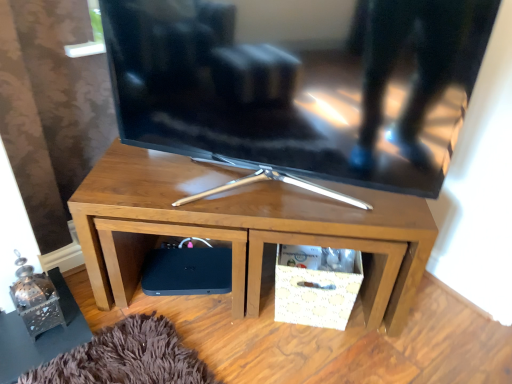
Question: Is matte black tv at center surrounded by black matte speaker at lower left?

Choices:
 (A) no
 (B) yes

Answer: (A)

Question: Could you tell me if black matte speaker at lower left is facing matte black tv at center?

Choices:
 (A) yes
 (B) no

Answer: (B)

Question: Does black matte speaker at lower left appear on the right side of matte black tv at center?

Choices:
 (A) no
 (B) yes

Answer: (A)

Question: Is black matte speaker at lower left wider than matte black tv at center?

Choices:
 (A) no
 (B) yes

Answer: (B)

Question: Is black matte speaker at lower left turned away from matte black tv at center?

Choices:
 (A) yes
 (B) no

Answer: (B)

Question: From the image's perspective, is matte black tv at center above or below wooden tv stand at center?

Choices:
 (A) above
 (B) below

Answer: (A)

Question: From a real-world perspective, is matte black tv at center physically located above or below wooden tv stand at center?

Choices:
 (A) above
 (B) below

Answer: (A)

Question: Is point (323, 56) closer or farther from the camera than point (180, 213)?

Choices:
 (A) closer
 (B) farther

Answer: (A)

Question: Is matte black tv at center in front of or behind wooden tv stand at center in the image?

Choices:
 (A) behind
 (B) front

Answer: (B)

Question: Choose the correct answer: Is wooden tv stand at center inside matte black tv at center or outside it?

Choices:
 (A) outside
 (B) inside

Answer: (A)

Question: Looking at their shapes, would you say wooden tv stand at center is wider or thinner than matte black tv at center?

Choices:
 (A) wide
 (B) thin

Answer: (A)

Question: Based on their sizes in the image, would you say wooden tv stand at center is bigger or smaller than matte black tv at center?

Choices:
 (A) big
 (B) small

Answer: (A)

Question: Is point (330, 183) closer or farther from the camera than point (300, 114)?

Choices:
 (A) closer
 (B) farther

Answer: (B)

Question: In terms of size, does wooden tv stand at center appear bigger or smaller than black matte speaker at lower left?

Choices:
 (A) big
 (B) small

Answer: (A)

Question: From the image's perspective, relative to black matte speaker at lower left, is wooden tv stand at center above or below?

Choices:
 (A) above
 (B) below

Answer: (A)